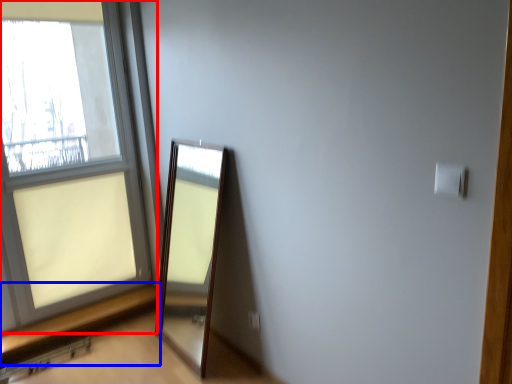
Question: Which object is closer to the camera taking this photo, window (highlighted by a red box) or window sill (highlighted by a blue box)?

Choices:
 (A) window
 (B) window sill

Answer: (A)